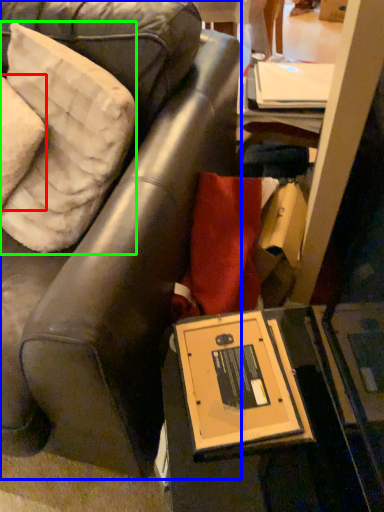
Question: Considering the real-world distances, which object is farthest from pillow (highlighted by a red box)? chair (highlighted by a blue box) or pillow (highlighted by a green box)?

Choices:
 (A) chair
 (B) pillow

Answer: (A)